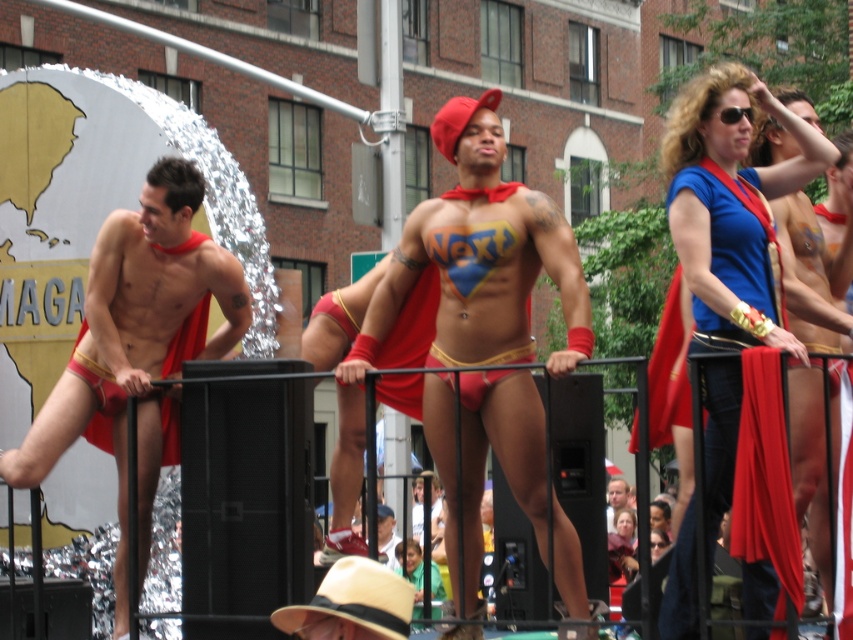
You are a costume designer observing the superhero group at the parade. You notice the matte red underwear at center and the matte red cape at center. Which one has a greater height?

The matte red underwear at center is taller than the matte red cape at center.

You are a photographer at the event and want to capture both the matte red underwear at center and the matte gold underwear at left in a single shot. Which underwear should you focus on first to ensure both are in frame?

Answer: The matte gold underwear at left should be focused on first since the matte red underwear at center is positioned to its right, allowing the photographer to frame both by starting from the left side.